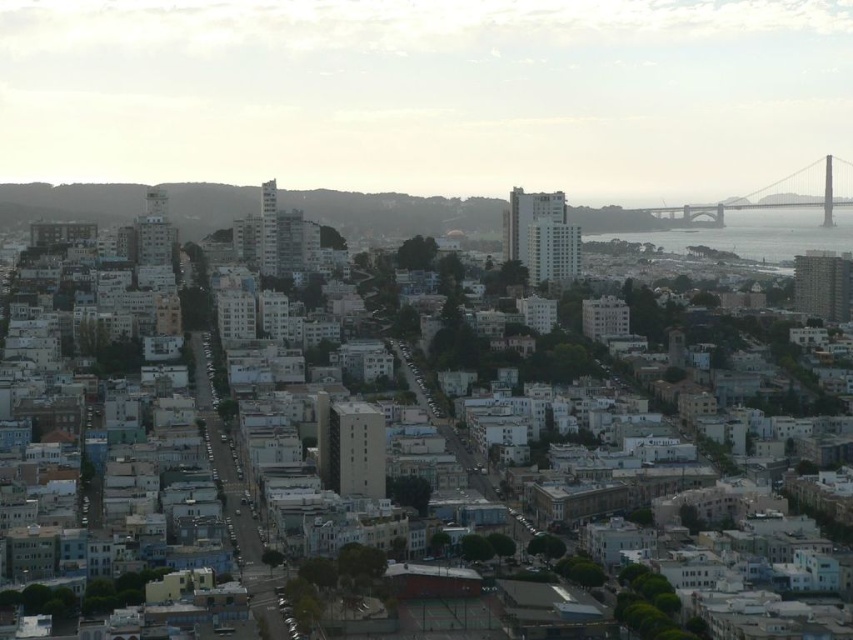
You are a drone operator tasked with capturing aerial footage of the city. You need to fly your drone from the clear water at lower right to the gray concrete bridge at upper right. Considering their relative heights, will the drone need to ascend or descend to reach the bridge?

The clear water at lower right is not as tall as the gray concrete bridge at upper right, so the drone will need to ascend to reach the bridge.

You are a drone operator tasked with capturing aerial footage of the city. You need to fly your drone from the clear water at lower right to the gray concrete bridge at upper right. Which direction should you steer the drone to reach the bridge?

The clear water at lower right is to the left of the gray concrete bridge at upper right, so you should steer the drone to the right to reach the bridge.